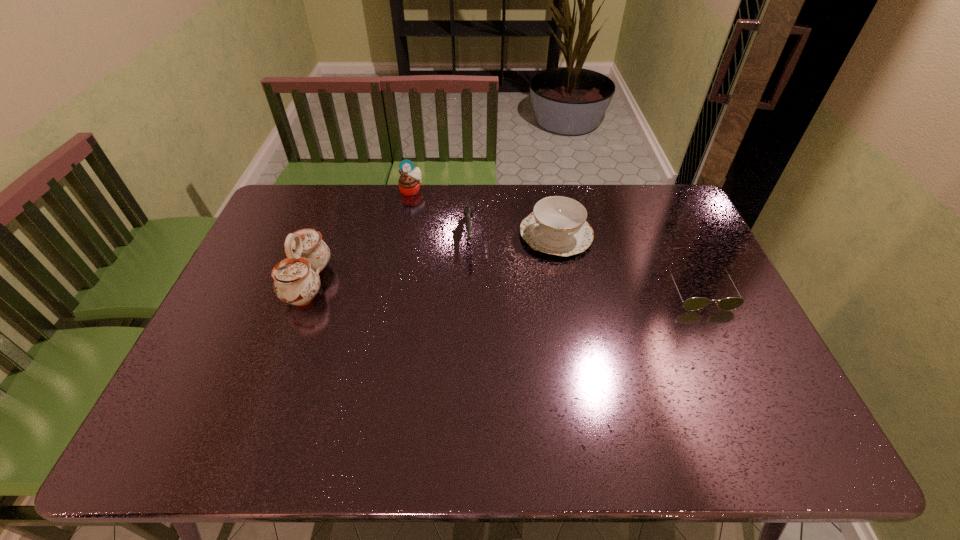
The image size is (960, 540). I want to click on the left chinaware, so click(x=296, y=279).

Find the location of a particular element. This screenshot has height=540, width=960. the tallest object is located at coordinates click(x=296, y=279).

This screenshot has width=960, height=540. I want to click on sunglasses, so click(x=696, y=303).

You are a GUI agent. You are given a task and a screenshot of the screen. Output one action in this format:
    pyautogui.click(x=<x>, y=<y>)
    Task: Click on the rightmost object
    Image resolution: width=960 pixels, height=540 pixels.
    Given the screenshot: What is the action you would take?
    pyautogui.click(x=696, y=303)

You are a GUI agent. You are given a task and a screenshot of the screen. Output one action in this format:
    pyautogui.click(x=<x>, y=<y>)
    Task: Click on the gun
    
    Given the screenshot: What is the action you would take?
    pyautogui.click(x=467, y=210)

Where is `the right chinaware`? the right chinaware is located at coordinates (557, 225).

Where is `the shorter chinaware`? the shorter chinaware is located at coordinates (557, 225).

The height and width of the screenshot is (540, 960). I want to click on the second tallest object, so click(409, 182).

Identify the location of the second object from left to right. Image resolution: width=960 pixels, height=540 pixels. (409, 182).

Identify the location of vacant area situated by the handle of the left chinaware. The image size is (960, 540). pos(366,283).